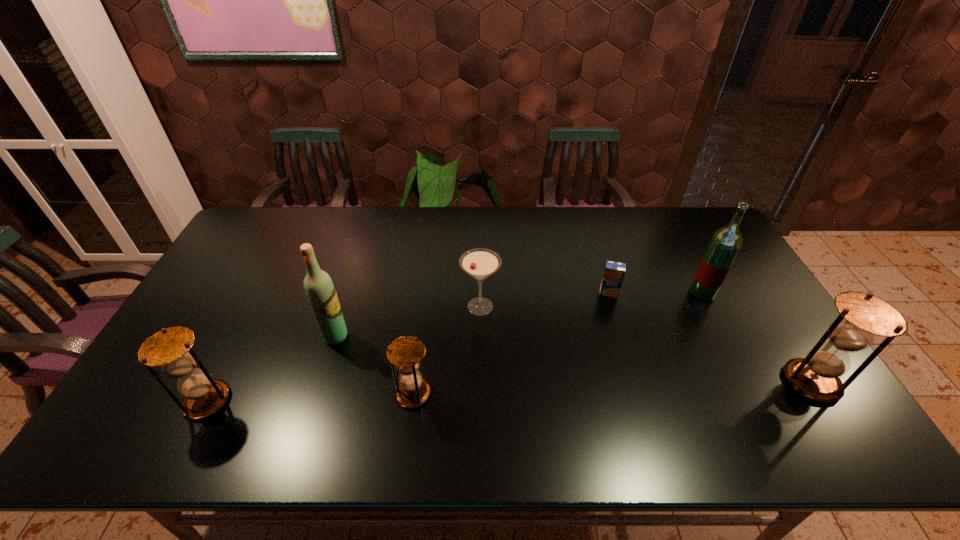
Find the location of a particular element. hourglass that is at the right edge is located at coordinates (861, 316).

This screenshot has height=540, width=960. Find the location of `liquor located at the right edge`. liquor located at the right edge is located at coordinates (725, 243).

The height and width of the screenshot is (540, 960). I want to click on object that is positioned at the near left corner, so click(170, 348).

The width and height of the screenshot is (960, 540). I want to click on object situated at the near right corner, so [861, 316].

Locate an element on the screen. The image size is (960, 540). free space at the far edge of the desktop is located at coordinates (613, 245).

This screenshot has width=960, height=540. I want to click on vacant space at the near edge of the desktop, so click(x=464, y=389).

At what (x,y) coordinates should I click in order to perform the action: click on free region at the left edge. Please return your answer as a coordinate pair (x, y). The image size is (960, 540). Looking at the image, I should click on (223, 265).

In the image, there is a desktop. At what (x,y) coordinates should I click in order to perform the action: click on free region at the far left corner. Please return your answer as a coordinate pair (x, y). This screenshot has height=540, width=960. Looking at the image, I should click on (254, 242).

I want to click on vacant space at the near left corner, so click(x=132, y=399).

You are a GUI agent. You are given a task and a screenshot of the screen. Output one action in this format:
    pyautogui.click(x=<x>, y=<y>)
    Task: Click on the free space at the far right corner of the desktop
    This screenshot has width=960, height=540.
    Given the screenshot: What is the action you would take?
    pyautogui.click(x=697, y=226)